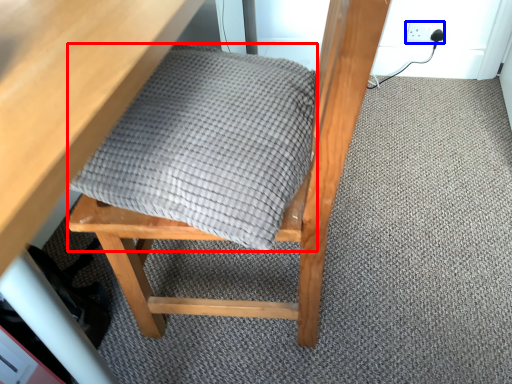
Question: Which object appears farthest to the camera in this image, blanket (highlighted by a red box) or electric outlet (highlighted by a blue box)?

Choices:
 (A) blanket
 (B) electric outlet

Answer: (B)